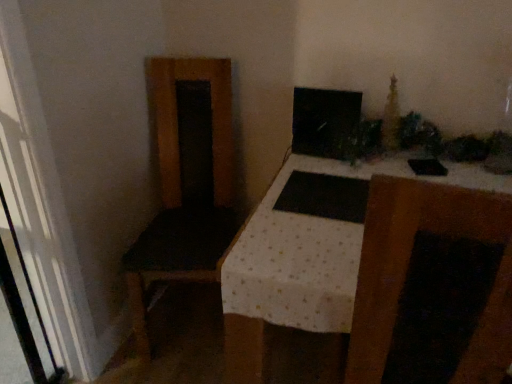
This screenshot has height=384, width=512. I want to click on matte black monitor at upper center, so click(x=324, y=121).

This screenshot has height=384, width=512. What do you see at coordinates (324, 121) in the screenshot? I see `matte black monitor at upper center` at bounding box center [324, 121].

The width and height of the screenshot is (512, 384). What are the coordinates of `white textured table at center` in the screenshot? It's located at (377, 270).

Measure the distance between white textured table at center and camera.

They are 24.76 inches apart.

The image size is (512, 384). What do you see at coordinates (377, 270) in the screenshot?
I see `white textured table at center` at bounding box center [377, 270].

Find the location of a particular element. matte black monitor at upper center is located at coordinates (324, 121).

In the image, is matte black monitor at upper center on the left side or the right side of white textured table at center?

In the image, matte black monitor at upper center appears on the left side of white textured table at center.

In the scene shown: Which object is further away from the camera taking this photo, matte black monitor at upper center or white textured table at center?

matte black monitor at upper center is more distant.

Which point is more distant from viewer, (325, 90) or (254, 312)?

The point (325, 90) is farther from the camera.

From the image's perspective, relative to white textured table at center, is matte black monitor at upper center above or below?

matte black monitor at upper center is situated higher than white textured table at center in the image.

From a real-world perspective, between matte black monitor at upper center and white textured table at center, who is vertically higher?

In real-world perspective, matte black monitor at upper center is above.

Does matte black monitor at upper center have a lesser width compared to white textured table at center?

Yes.

From the picture: Considering the sizes of matte black monitor at upper center and white textured table at center in the image, is matte black monitor at upper center taller or shorter than white textured table at center?

matte black monitor at upper center is shorter than white textured table at center.

Who is smaller, matte black monitor at upper center or white textured table at center?

matte black monitor at upper center.

Can we say matte black monitor at upper center lies outside white textured table at center?

That's correct, matte black monitor at upper center is outside of white textured table at center.

Is matte black monitor at upper center next to white textured table at center and touching it?

matte black monitor at upper center and white textured table at center are clearly separated.

Could you tell me if matte black monitor at upper center is turned towards white textured table at center?

No, matte black monitor at upper center does not turn towards white textured table at center.

How much distance is there between matte black monitor at upper center and white textured table at center?

44.89 centimeters.

Find the location of a particular element. table below the matte black monitor at upper center (from the image's perspective) is located at coordinates (377, 270).

Which is more to the left, white textured table at center or matte black monitor at upper center?

matte black monitor at upper center.

Relative to matte black monitor at upper center, is white textured table at center in front or behind?

white textured table at center is positioned closer to the viewer than matte black monitor at upper center.

Considering the positions of points (382, 230) and (298, 115), is point (382, 230) farther from camera compared to point (298, 115)?

No, it is in front of (298, 115).

From the image's perspective, which one is positioned lower, white textured table at center or matte black monitor at upper center?

white textured table at center, from the image's perspective.

From a real-world perspective, is white textured table at center beneath matte black monitor at upper center?

Correct, in the physical world, white textured table at center is lower than matte black monitor at upper center.

Can you confirm if white textured table at center is wider than matte black monitor at upper center?

Correct, the width of white textured table at center exceeds that of matte black monitor at upper center.

Who is taller, white textured table at center or matte black monitor at upper center?

white textured table at center.

Which of these two, white textured table at center or matte black monitor at upper center, is bigger?

white textured table at center.

Is white textured table at center outside of matte black monitor at upper center?

Yes, white textured table at center is outside of matte black monitor at upper center.

Is white textured table at center not close to matte black monitor at upper center?

No, white textured table at center is not far away from matte black monitor at upper center.

Is white textured table at center facing towards matte black monitor at upper center?

No, white textured table at center is not turned towards matte black monitor at upper center.

How different are the orientations of white textured table at center and matte black monitor at upper center in degrees?

The angular difference between white textured table at center and matte black monitor at upper center is 0.631 degrees.

Where is `table lying in front of the matte black monitor at upper center`? The width and height of the screenshot is (512, 384). table lying in front of the matte black monitor at upper center is located at coordinates (377, 270).

The width and height of the screenshot is (512, 384). Identify the location of computer monitor behind the white textured table at center. (324, 121).

What are the coordinates of `computer monitor that appears above the white textured table at center (from the image's perspective)` in the screenshot? It's located at (324, 121).